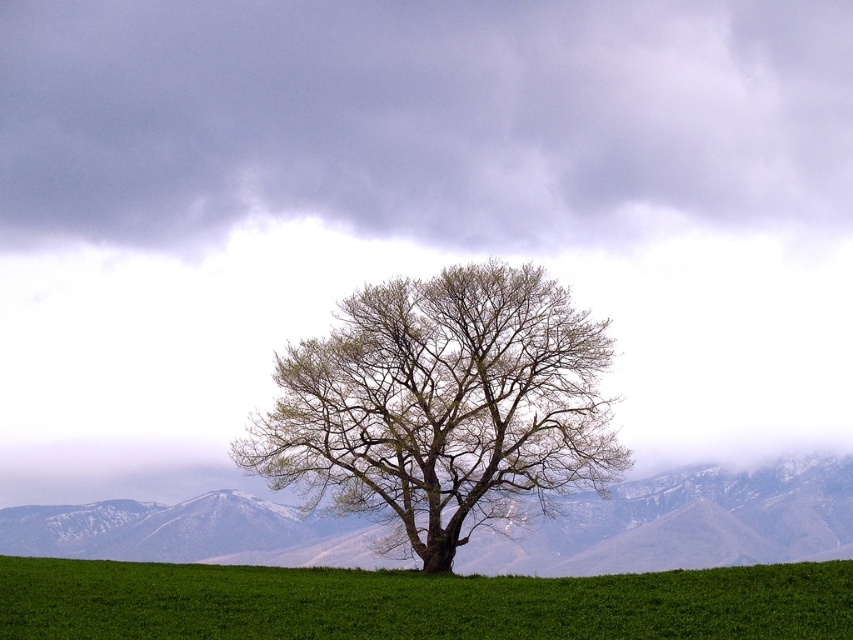
In the scene shown: Is green grassy field at center below snowy rock mountain at center?

No, green grassy field at center is not below snowy rock mountain at center.

Who is taller, green grassy field at center or snowy rock mountain at center?

Standing taller between the two is snowy rock mountain at center.

Which is in front, point (722, 588) or point (831, 522)?

Point (722, 588)

Locate an element on the screen. This screenshot has height=640, width=853. green grassy field at center is located at coordinates (416, 602).

Is bare branches at center taller than snowy rock mountain at center?

Yes.

Looking at this image, does bare branches at center appear on the left side of snowy rock mountain at center?

In fact, bare branches at center is to the right of snowy rock mountain at center.

Which is behind, point (505, 282) or point (683, 524)?

Point (683, 524)

Find the location of `bare branches at center`. bare branches at center is located at coordinates (442, 406).

Does bare branches at center appear on the left side of green grassy field at center?

In fact, bare branches at center is to the right of green grassy field at center.

Describe the element at coordinates (442, 406) in the screenshot. Image resolution: width=853 pixels, height=640 pixels. I see `bare branches at center` at that location.

Which is behind, point (480, 280) or point (97, 564)?

The point (480, 280) is more distant.

At what (x,y) coordinates should I click in order to perform the action: click on bare branches at center. Please return your answer as a coordinate pair (x, y). Looking at the image, I should click on (442, 406).